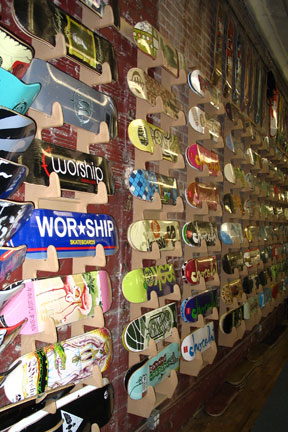
Identify the location of opening in wall. Image resolution: width=288 pixels, height=432 pixels. 270,83.